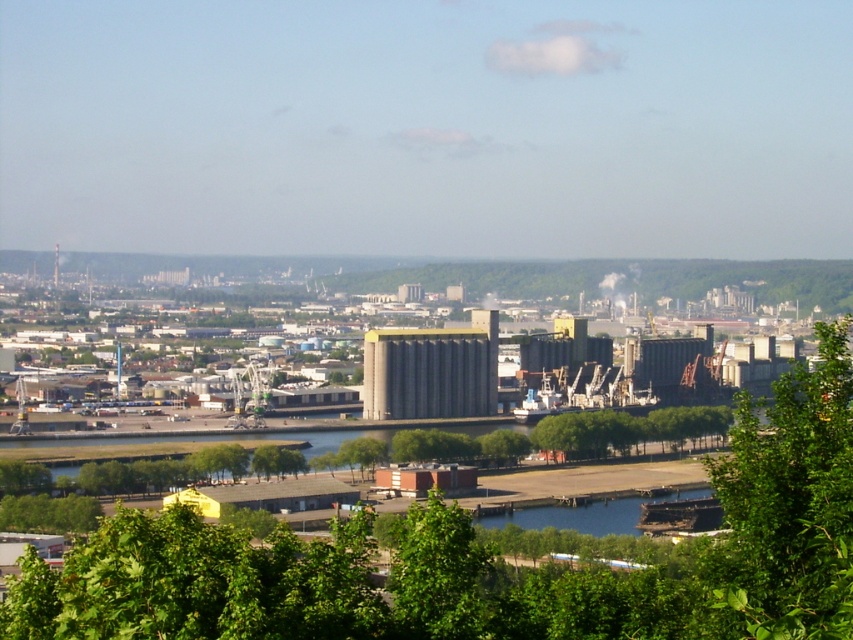
You are standing at the center of the image. Which direction should you move to get closer to the green leafy tree at lower right?

Since the green leafy tree at lower right is located at point 0.786 on the x axis and 0.927 on the y axis, you should move towards the lower right direction to get closer to it.

You are standing at the edge of the industrial complex and want to take a photo of the gray concrete silos at center without the green leafy tree at lower right blocking the view. Which direction should you move to ensure the silos are visible without obstruction?

You should move to a higher elevation or position yourself above the green leafy tree at lower right since the gray concrete silos at center are located above it, allowing you to frame the shot without the tree obstructing the view.